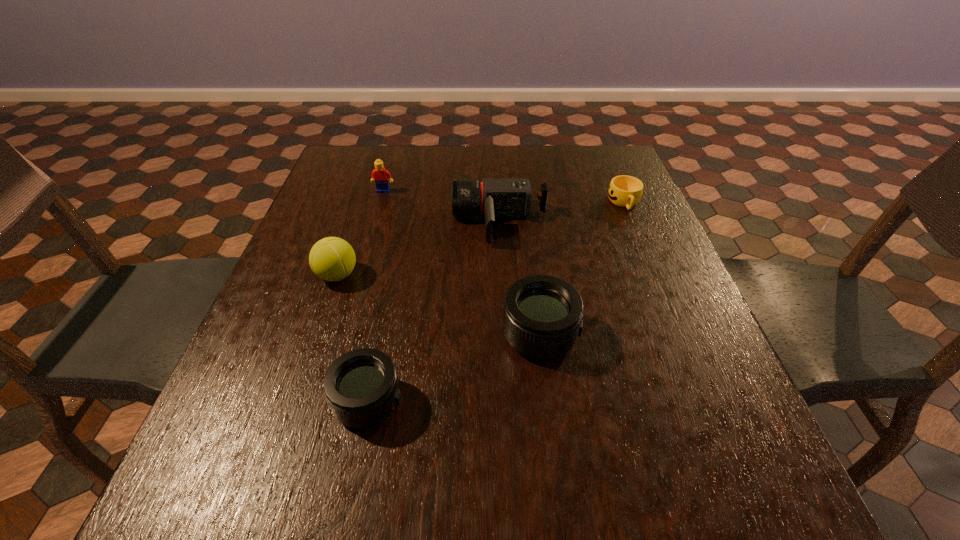
Please show where to add a telephoto lens on the right while keeping spacing even. Please provide its 2D coordinates. Your answer should be formatted as a tuple, i.e. [(x, y)], where the tuple contains the x and y coordinates of a point satisfying the conditions above.

[(675, 282)]